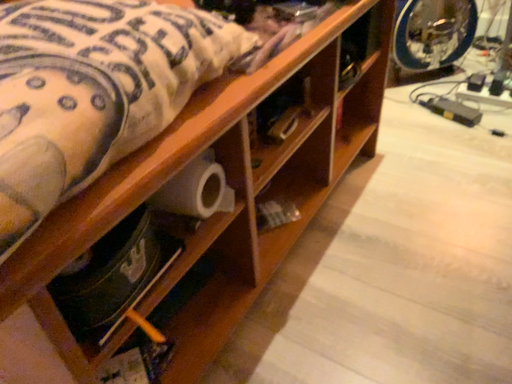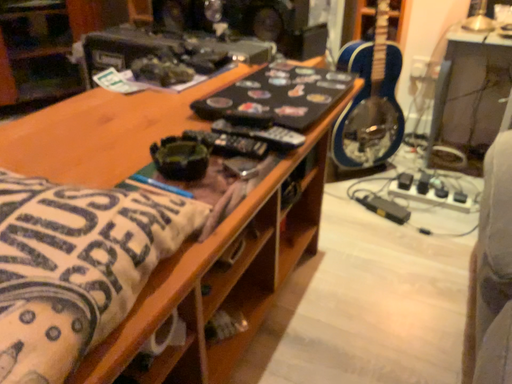
Question: Which way did the camera rotate in the video?

Choices:
 (A) rotated upward
 (B) rotated downward

Answer: (A)